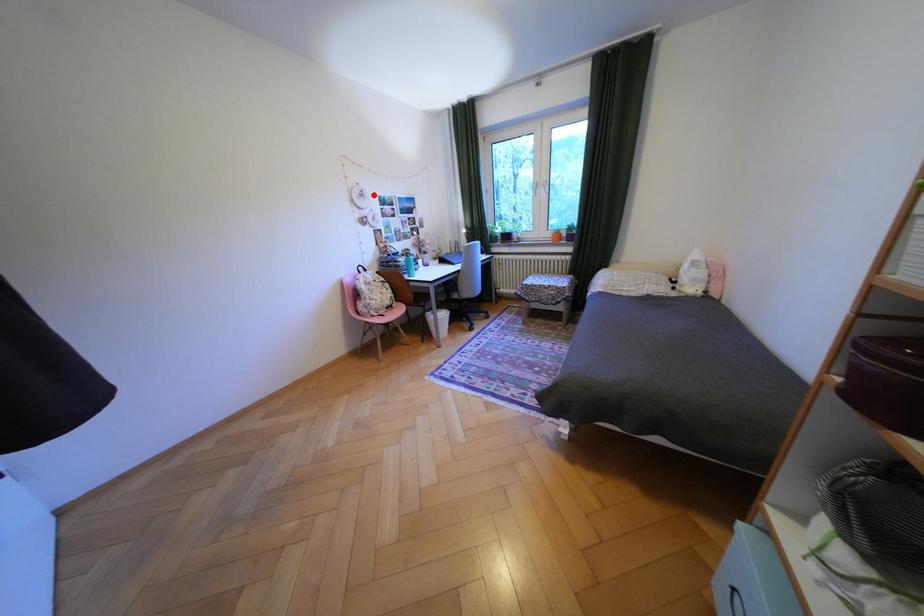
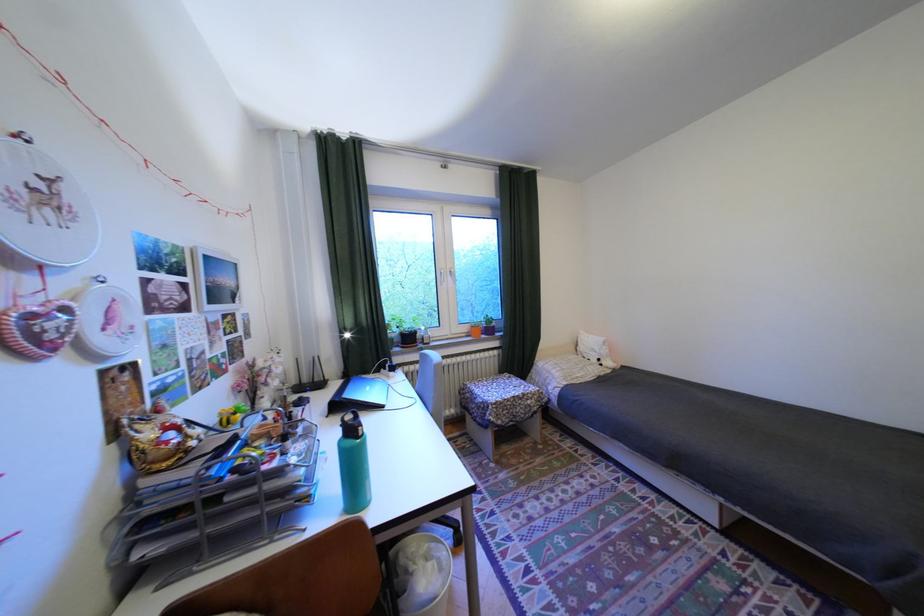
Question: I am providing you with two images of the same scene from different viewpoints. Given a red point in image1, look at the same physical point in image2. Is it:

Choices:
 (A) Closer to the viewpoint
 (B) Farther from the viewpoint

Answer: (B)